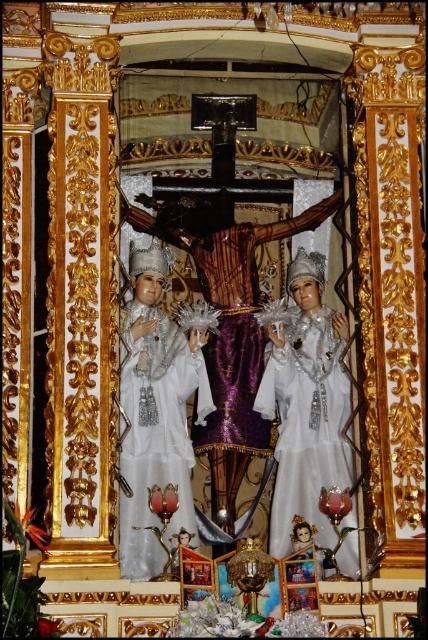
You are standing at the base of the altar facing the crucifix. There are two points marked on the altar surface. The first point is at coordinates point (142, 257) and the second is at point (276, 556). Which point is closer to you?

Point (276, 556) is closer to you because it is in front of point (142, 257).

You are an altar cleaner who needs to place a new white satin dress at center on the altar. However, there is already a white glossy statue at center in the way. Based on the scene description, can you determine if the statue is blocking the exact center position where the dress needs to be placed?

The white glossy statue at center is positioned over the white satin dress at center, meaning the statue is directly blocking the center position where the dress needs to be placed. You will need to move the statue to place the dress there.